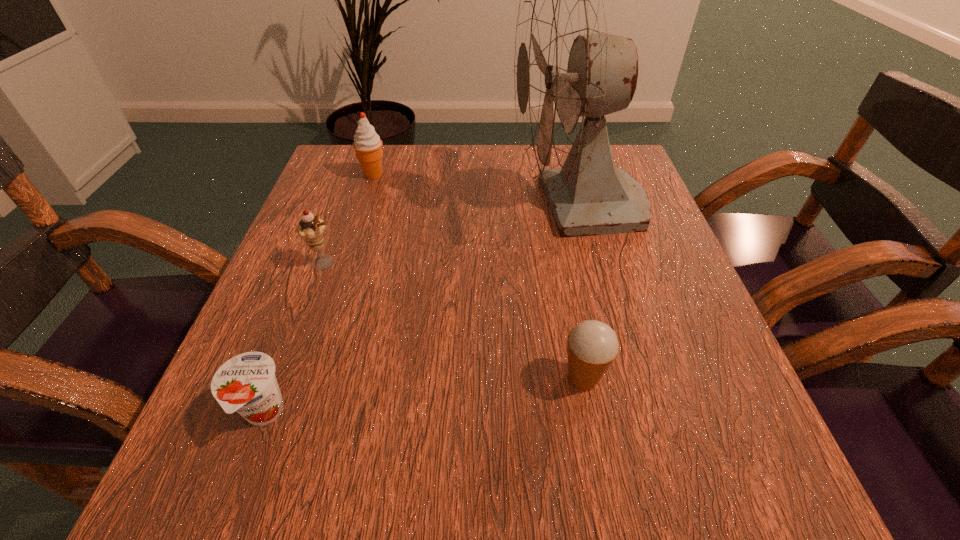
The width and height of the screenshot is (960, 540). What are the coordinates of `unoccupied position between the second farthest icecream and the farthest icecream` in the screenshot? It's located at (349, 219).

The height and width of the screenshot is (540, 960). Find the location of `free spot between the shortest icecream and the yogurt`. free spot between the shortest icecream and the yogurt is located at coordinates (423, 396).

At what (x,y) coordinates should I click in order to perform the action: click on free point between the fan and the second farthest icecream. Please return your answer as a coordinate pair (x, y). The image size is (960, 540). Looking at the image, I should click on (452, 234).

Identify the location of empty location between the yogurt and the second nearest icecream. The image size is (960, 540). (295, 338).

At what (x,y) coordinates should I click in order to perform the action: click on vacant space in between the tallest object and the farthest icecream. Please return your answer as a coordinate pair (x, y). Looking at the image, I should click on (476, 191).

This screenshot has height=540, width=960. Find the location of `empty space between the fan and the second nearest icecream`. empty space between the fan and the second nearest icecream is located at coordinates (452, 234).

Find the location of `object that is the third closest to the fan`. object that is the third closest to the fan is located at coordinates (311, 229).

Point out which object is positioned as the nearest to the yogurt. Please provide its 2D coordinates. Your answer should be formatted as a tuple, i.e. [(x, y)], where the tuple contains the x and y coordinates of a point satisfying the conditions above.

[(311, 229)]

Locate which icecream ranks second in proximity to the second farthest icecream. Please provide its 2D coordinates. Your answer should be formatted as a tuple, i.e. [(x, y)], where the tuple contains the x and y coordinates of a point satisfying the conditions above.

[(592, 345)]

Point out which icecream is positioned as the nearest to the fan. Please provide its 2D coordinates. Your answer should be formatted as a tuple, i.e. [(x, y)], where the tuple contains the x and y coordinates of a point satisfying the conditions above.

[(592, 345)]